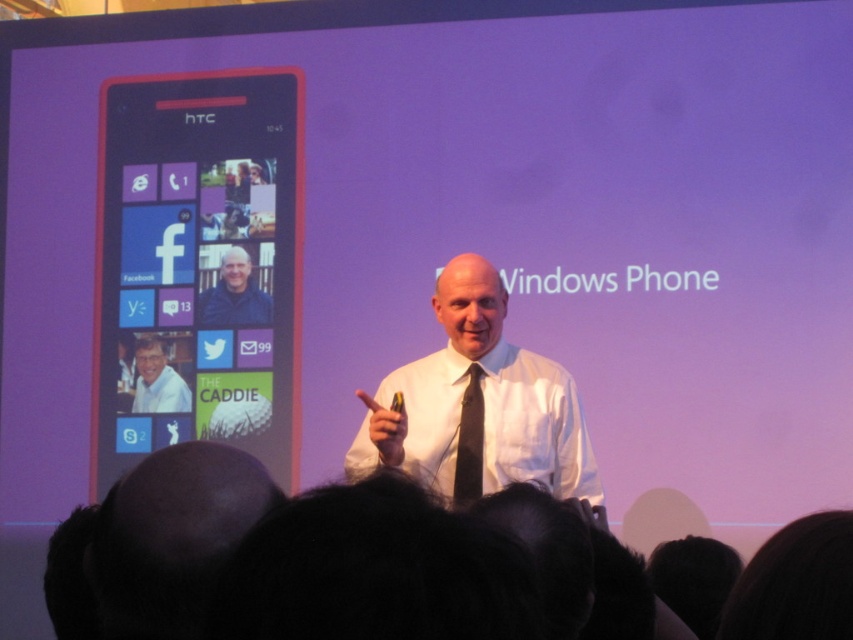
Question: Estimate the real-world distances between objects in this image. Which object is farther from the silky black tie at center?

Choices:
 (A) white shirt at center
 (B) matte black shirt at center

Answer: (B)

Question: Does matte black shirt at center appear under matte white shirt at center?

Choices:
 (A) no
 (B) yes

Answer: (A)

Question: Which of the following is the closest to the observer?

Choices:
 (A) matte black shirt at center
 (B) pink glossy phone at left

Answer: (B)

Question: Which of these objects is positioned closest to the pink glossy phone at left?

Choices:
 (A) matte black shirt at center
 (B) silky black tie at center

Answer: (A)

Question: Can you confirm if matte black shirt at center is smaller than matte white shirt at center?

Choices:
 (A) no
 (B) yes

Answer: (A)

Question: Where is white shirt at center located in relation to matte white shirt at center in the image?

Choices:
 (A) left
 (B) right

Answer: (B)